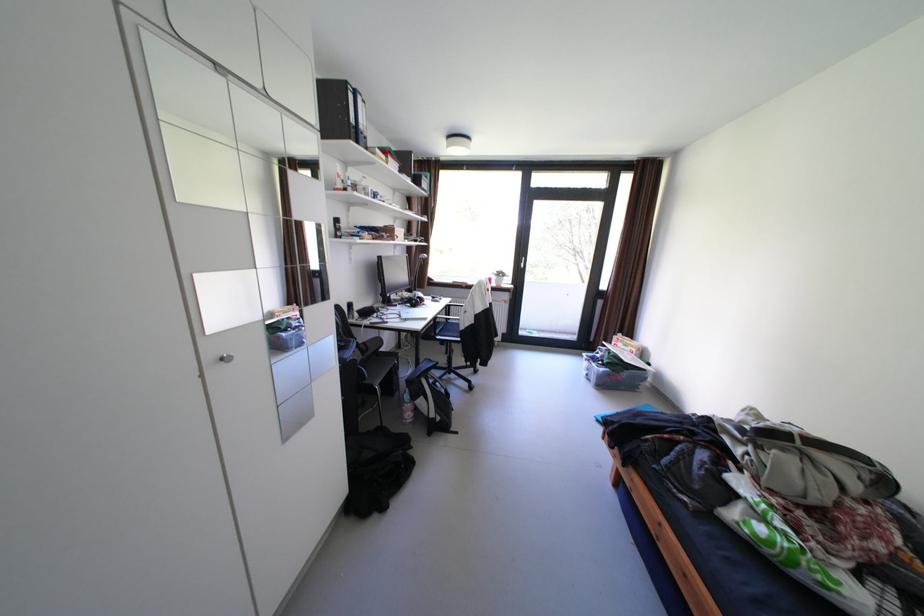
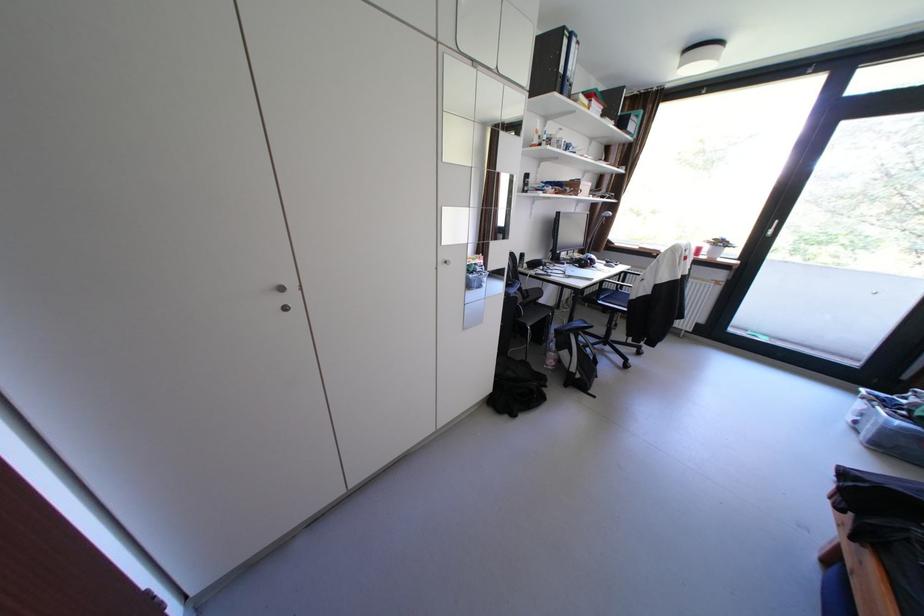
The point at (x=361, y=97) is marked in the first image. Where is the corresponding point in the second image?

(576, 42)